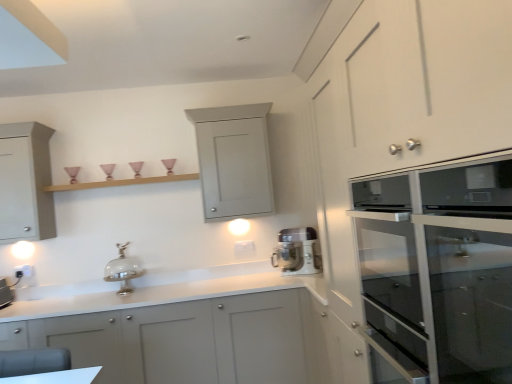
Question: From the image's perspective, is wooden shelf at upper center positioned above or below matte gray cabinet at lower left, the third cabinetry when ordered from back to front?

Choices:
 (A) above
 (B) below

Answer: (A)

Question: Considering the positions of point (55, 185) and point (257, 357), is point (55, 185) closer or farther from the camera than point (257, 357)?

Choices:
 (A) closer
 (B) farther

Answer: (B)

Question: Considering the real-world distances, which object is closest to the shiny silver cake stand at center?

Choices:
 (A) white plastic electric outlet at lower left
 (B) white glossy stand mixer at center
 (C) matte glass oven at right, positioned as the fourth cabinetry in back-to-front order
 (D) matte gray cabinet at left, which ranks as the 2th cabinetry in back-to-front order
 (E) wooden shelf at upper center

Answer: (E)

Question: Estimate the real-world distances between objects in this image. Which object is farther from the shiny silver cake stand at center?

Choices:
 (A) matte gray cabinet at left, which ranks as the third cabinetry in front-to-back order
 (B) wooden shelf at upper center
 (C) matte gray cabinet at upper center, the 1th cabinetry positioned from the back
 (D) matte glass oven at right, the first cabinetry from the front
 (E) matte gray cabinet at lower left, the third cabinetry when ordered from back to front

Answer: (D)